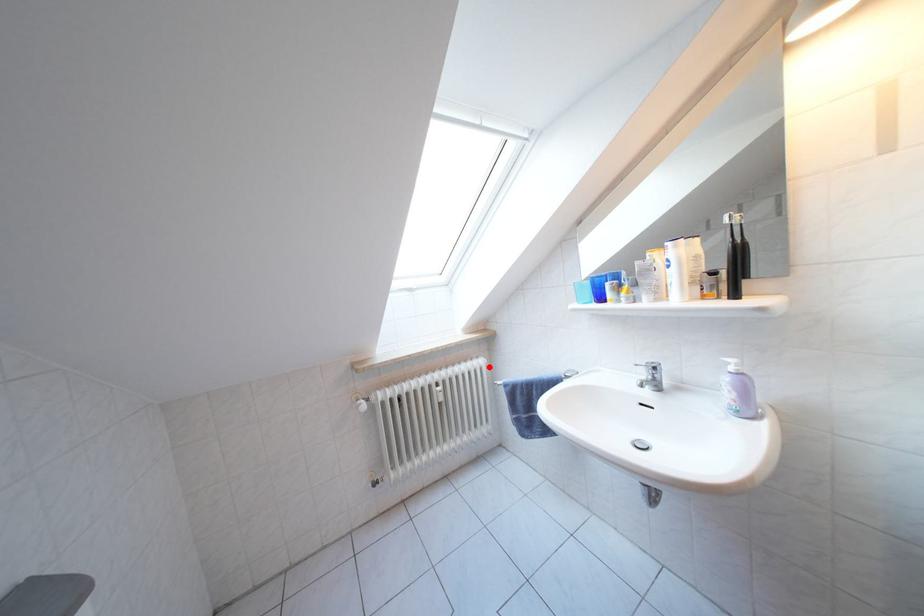
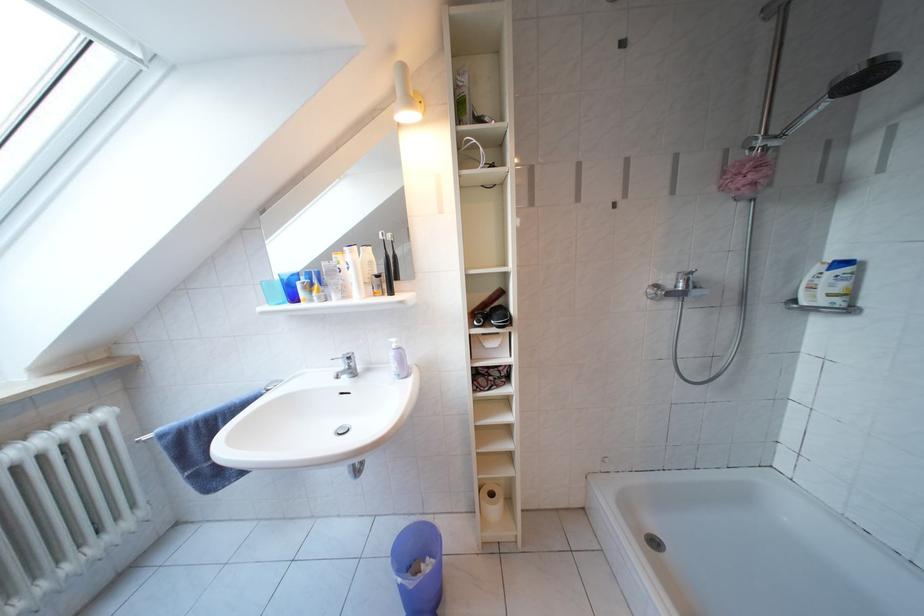
Locate, in the second image, the point that corresponds to the highlighted location in the first image.

(110, 421)